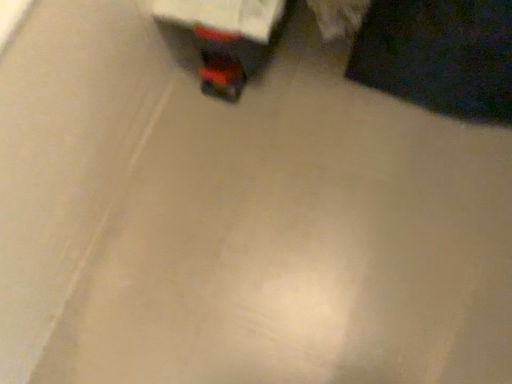
What do you see at coordinates (228, 37) in the screenshot? I see `matte black laptop at upper left` at bounding box center [228, 37].

I want to click on matte black laptop at upper left, so click(228, 37).

What is the approximate height of matte black laptop at upper left?

The height of matte black laptop at upper left is 10.11 inches.

Locate an element on the screen. matte black laptop at upper left is located at coordinates (228, 37).